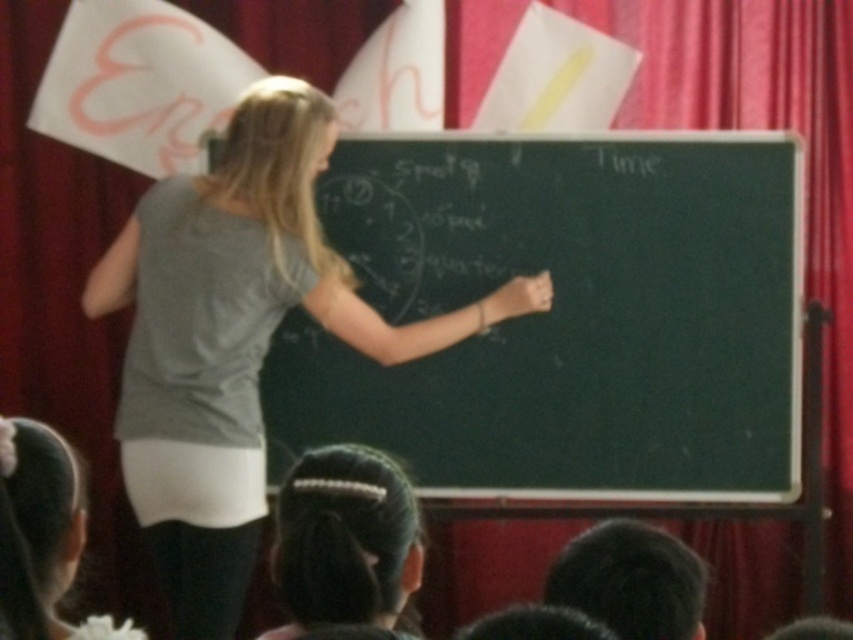
From the picture: You are a student sitting in the classroom. You need to pass a note to the person wearing the gray fabric shirt at center. The note is on the desk of the person with black hair at lower center. Can you reach the note without leaving your seat?

The distance between the gray fabric shirt at center and the black hair at lower center is 3.67 feet. Since the note is on the desk of the person with black hair at lower center, you can reach it if your arm can stretch 3.67 feet. However, typical human arm length is about 2.5 feet, so you might need to ask someone nearby to help.

You are a student sitting at the back of the classroom. The teacher is standing 2 meters away from you. If you want to reach the black chalkboard at center, how much farther do you need to walk compared to the teacher?

The black chalkboard at center is 3.41 meters away from the viewer. Since the teacher is 2 meters away from you, you need to walk an additional 1.41 meters to reach the black chalkboard at center.